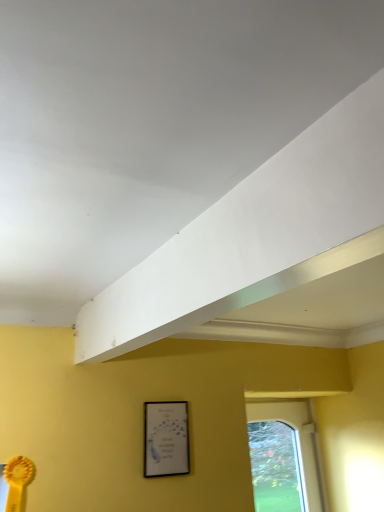
Question: Based on their sizes in the image, would you say white matte exhaust hood at upper center is bigger or smaller than matte black picture frame at lower center?

Choices:
 (A) small
 (B) big

Answer: (B)

Question: From a real-world perspective, is white matte exhaust hood at upper center physically located above or below matte black picture frame at lower center?

Choices:
 (A) above
 (B) below

Answer: (A)

Question: Considering the real-world distances, which object is farthest from the white matte exhaust hood at upper center?

Choices:
 (A) clear glass window at lower right
 (B) matte black picture frame at lower center

Answer: (A)

Question: Considering the real-world distances, which object is closest to the matte black picture frame at lower center?

Choices:
 (A) white matte exhaust hood at upper center
 (B) clear glass window at lower right

Answer: (A)